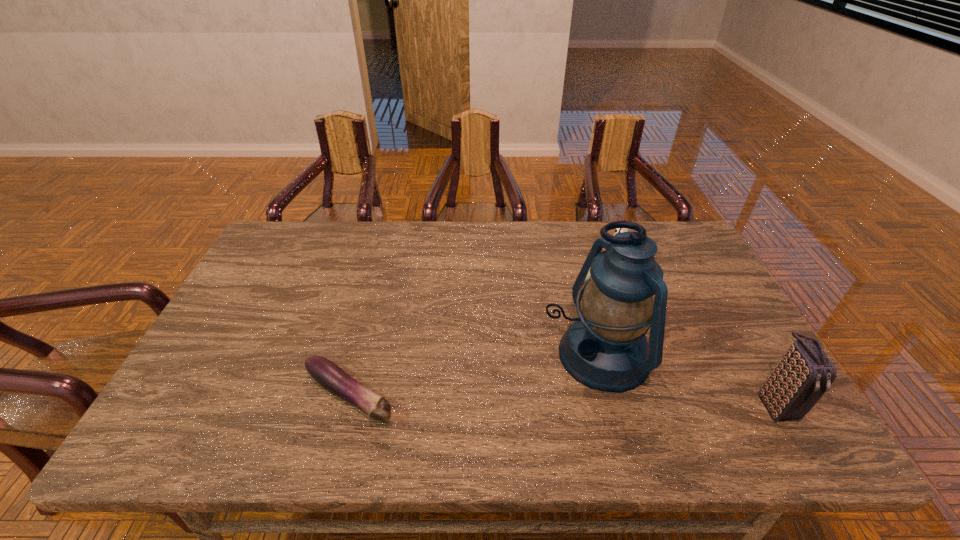
This screenshot has height=540, width=960. In order to click on eggplant in this screenshot , I will do `click(327, 374)`.

At what (x,y) coordinates should I click in order to perform the action: click on the shortest object. Please return your answer as a coordinate pair (x, y). Looking at the image, I should click on (327, 374).

Locate an element on the screen. This screenshot has width=960, height=540. clutch bag is located at coordinates (802, 376).

You are a GUI agent. You are given a task and a screenshot of the screen. Output one action in this format:
    pyautogui.click(x=<x>, y=<y>)
    Task: Click on the bird
    The height and width of the screenshot is (540, 960).
    Given the screenshot: What is the action you would take?
    pyautogui.click(x=619, y=230)

The image size is (960, 540). Identify the location of the tallest object. (606, 349).

This screenshot has height=540, width=960. In order to click on free space located on the left of the shortest object in this screenshot , I will do `click(177, 397)`.

This screenshot has width=960, height=540. I want to click on vacant space located at the face of the farthest object, so click(595, 307).

Where is `free point located at the face of the farthest object`? This screenshot has height=540, width=960. free point located at the face of the farthest object is located at coordinates (581, 329).

I want to click on vacant space located at the face of the farthest object, so click(594, 309).

Find the location of a particular element. Image resolution: width=960 pixels, height=540 pixels. free space located 0.200m on the face of the tallest object is located at coordinates (483, 410).